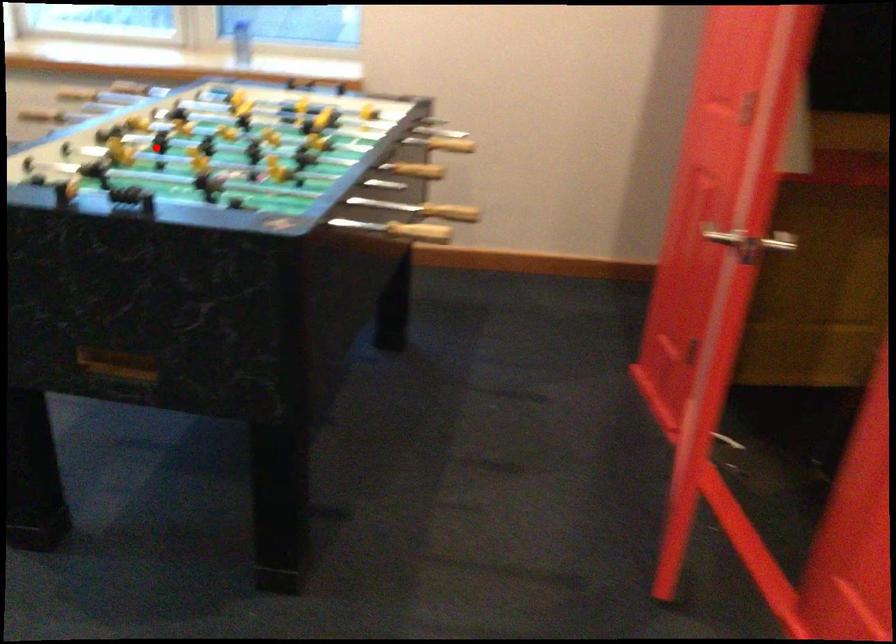
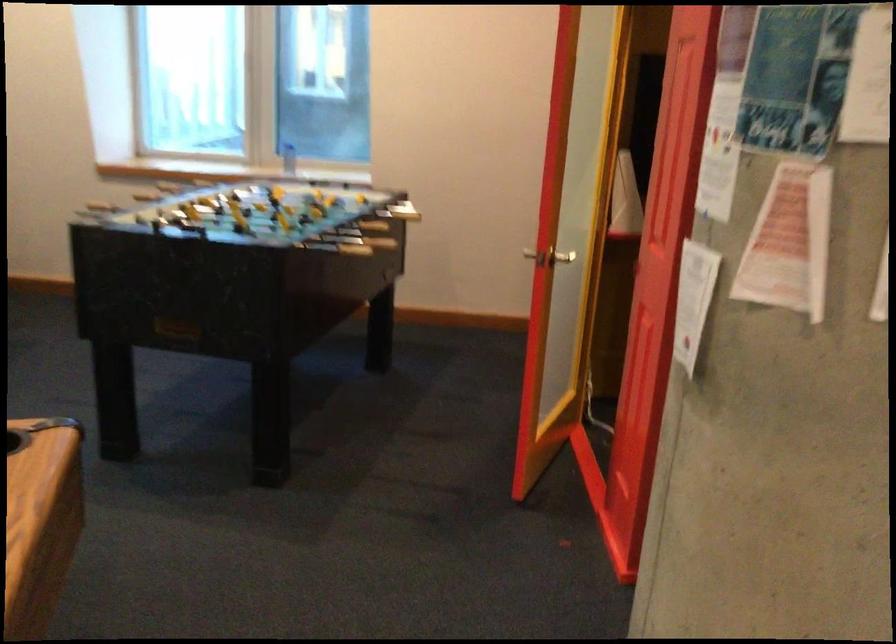
Question: I am providing you with two images of the same scene from different viewpoints. A red point is shown in image1. For the corresponding object point in image2, is it positioned nearer or farther from the camera?

Choices:
 (A) Nearer
 (B) Farther

Answer: (B)